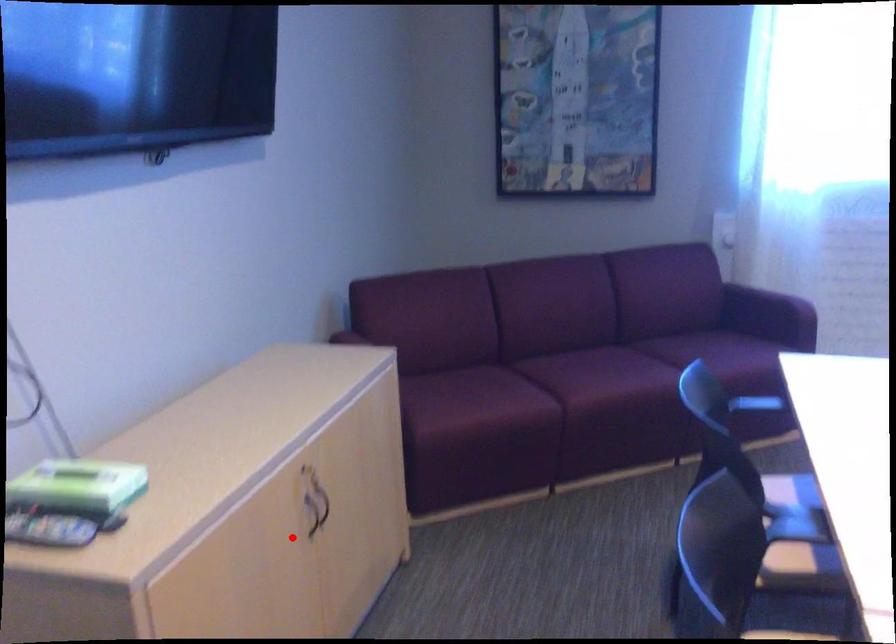
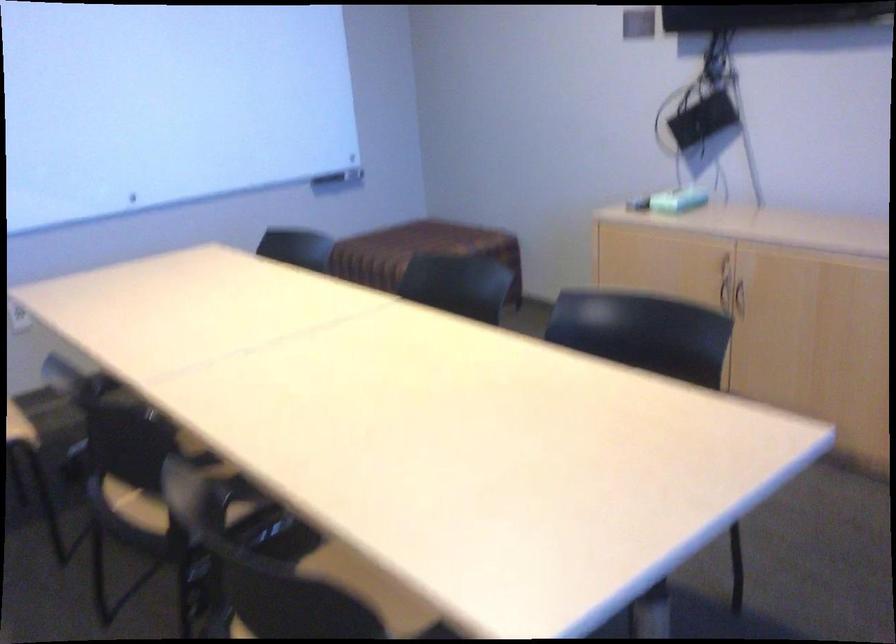
Question: A red point is marked in image1. In image2, is the corresponding 3D point closer to the camera or farther? Reply with the corresponding letter.

Choices:
 (A) The corresponding 3D point is closer.
 (B) The corresponding 3D point is farther.

Answer: (B)